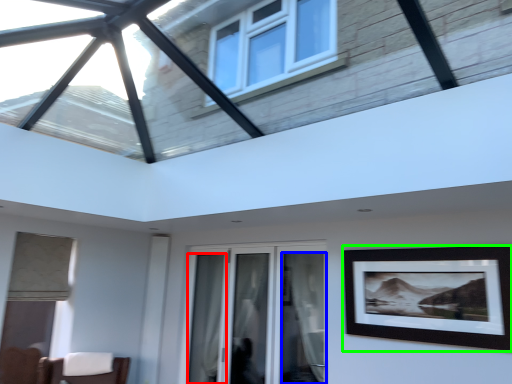
Question: Which object is the closest to the curtain (highlighted by a red box)? Choose among these: curtain (highlighted by a blue box) or picture frame (highlighted by a green box).

Choices:
 (A) curtain
 (B) picture frame

Answer: (A)